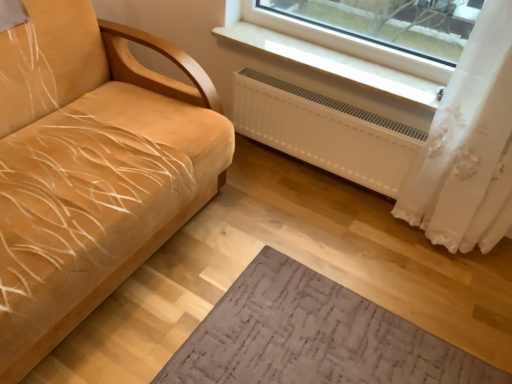
The height and width of the screenshot is (384, 512). I want to click on free spot above white plastic radiator at upper center (from a real-world perspective), so click(x=372, y=67).